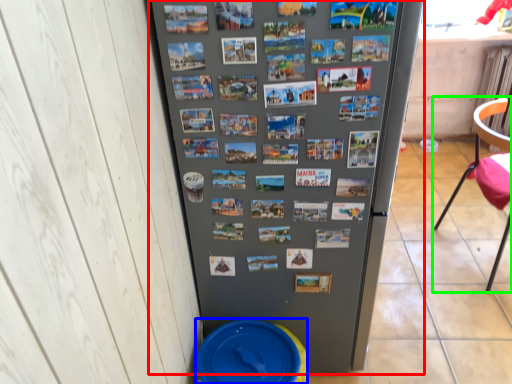
Question: Estimate the real-world distances between objects in this image. Which object is closer to refrigerator (highlighted by a red box), potty (highlighted by a blue box) or chair (highlighted by a green box)?

Choices:
 (A) potty
 (B) chair

Answer: (A)